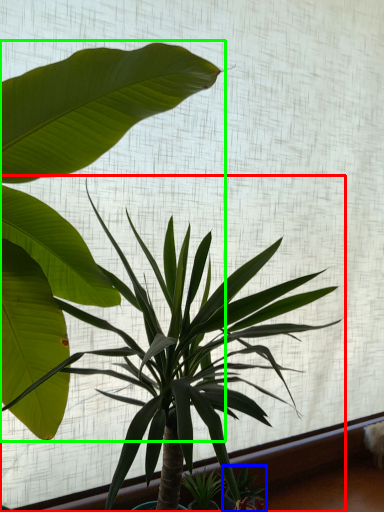
Question: Which object is the farthest from houseplant (highlighted by a red box)? Choose among these: plant (highlighted by a blue box) or houseplant (highlighted by a green box).

Choices:
 (A) plant
 (B) houseplant

Answer: (A)